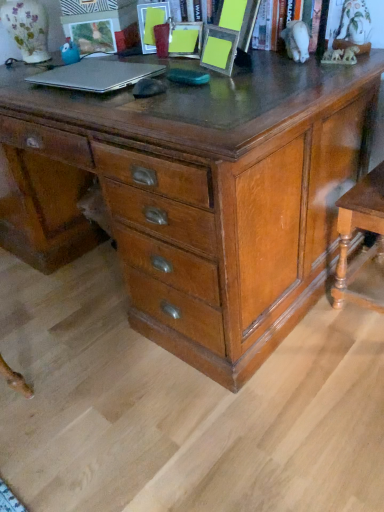
The image size is (384, 512). What are the coordinates of `vacant area that lies in front of shiny brown wooden chest of drawers at center` in the screenshot? It's located at (166, 399).